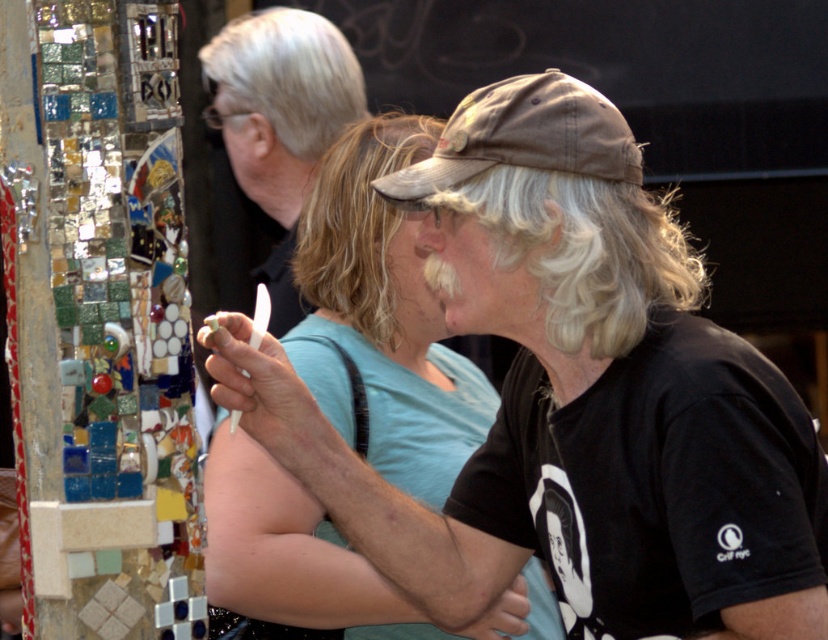
Can you confirm if light blue cotton shirt at center is taller than white matte cap at upper center?

In fact, light blue cotton shirt at center may be shorter than white matte cap at upper center.

Which is below, light blue cotton shirt at center or white matte cap at upper center?

Positioned lower is light blue cotton shirt at center.

Find the location of a particular element. Image resolution: width=828 pixels, height=640 pixels. light blue cotton shirt at center is located at coordinates (383, 316).

I want to click on light blue cotton shirt at center, so click(x=383, y=316).

The height and width of the screenshot is (640, 828). Identify the location of light blue cotton shirt at center. (383, 316).

Which of these two, light blue cotton shirt at center or tan fabric baseball cap at center, stands shorter?

With less height is tan fabric baseball cap at center.

Is point (314, 384) positioned after point (509, 80)?

No, it is in front of (509, 80).

In order to click on light blue cotton shirt at center in this screenshot , I will do `click(383, 316)`.

Is white matte cap at upper center shorter than tan fabric baseball cap at center?

Incorrect, white matte cap at upper center's height does not fall short of tan fabric baseball cap at center's.

Describe the element at coordinates (280, 120) in the screenshot. Image resolution: width=828 pixels, height=640 pixels. I see `white matte cap at upper center` at that location.

You are a GUI agent. You are given a task and a screenshot of the screen. Output one action in this format:
    pyautogui.click(x=<x>, y=<y>)
    Task: Click on the white matte cap at upper center
    This screenshot has height=640, width=828.
    Given the screenshot: What is the action you would take?
    pyautogui.click(x=280, y=120)